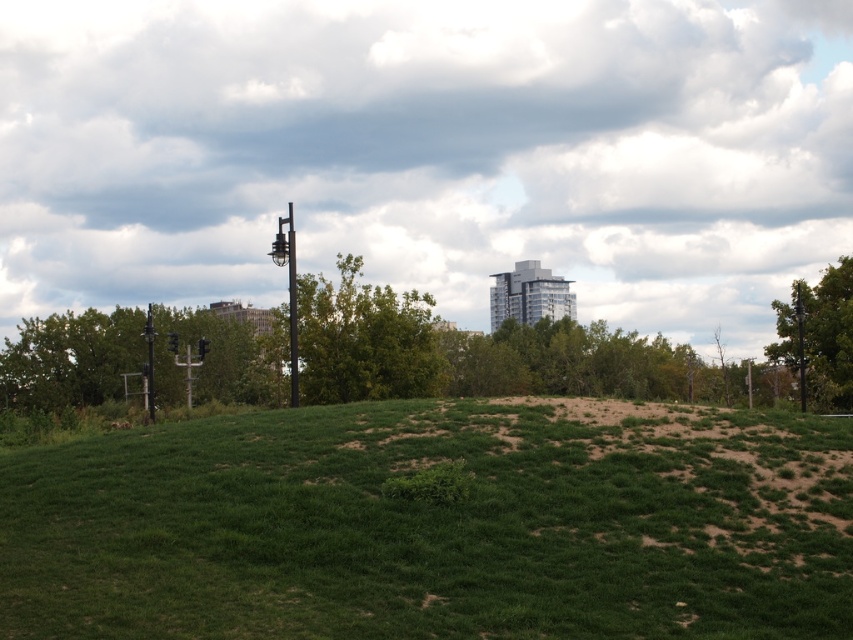
Question: Considering the real-world distances, which object is closest to the green leafy tree at right?

Choices:
 (A) green grassy hill at center
 (B) green leafy tree at left
 (C) metallic pole at center

Answer: (C)

Question: Which object is the farthest from the green leafy tree at center?

Choices:
 (A) green leafy tree at right
 (B) green leafy tree at left

Answer: (B)

Question: Does green leafy tree at center appear on the right side of metallic pole at center?

Choices:
 (A) no
 (B) yes

Answer: (B)

Question: Can you confirm if green leafy tree at right is bigger than metallic pole at center?

Choices:
 (A) yes
 (B) no

Answer: (B)

Question: Does green leafy tree at left have a greater width compared to green leafy tree at center?

Choices:
 (A) no
 (B) yes

Answer: (B)

Question: Among these objects, which one is farthest from the camera?

Choices:
 (A) green leafy tree at center
 (B) green leafy tree at right
 (C) green grassy hill at center
 (D) metallic pole at center

Answer: (B)